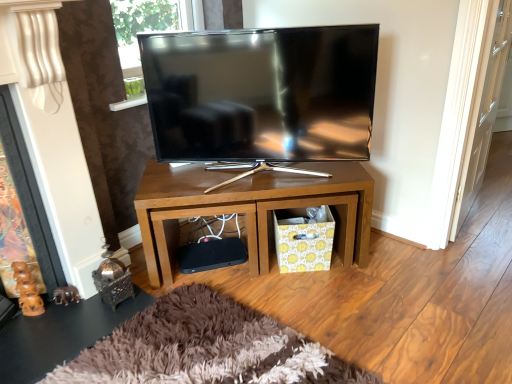
Where is `free space between wooden tv stand at center and yellow floral cardboard crate at lower center`? free space between wooden tv stand at center and yellow floral cardboard crate at lower center is located at coordinates (259, 280).